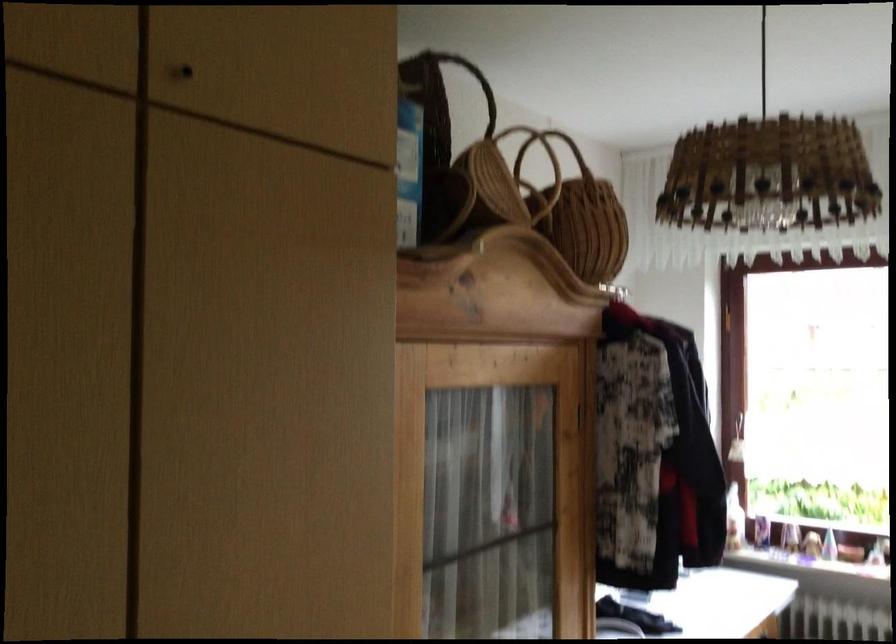
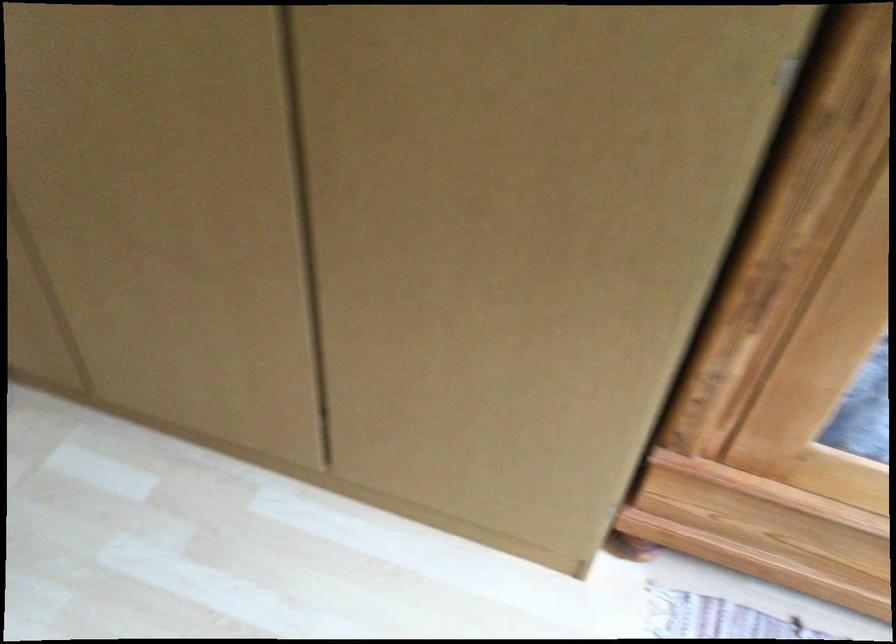
Based on the continuous images, in which direction is the camera rotating?

The rotation direction of the camera is left-down.